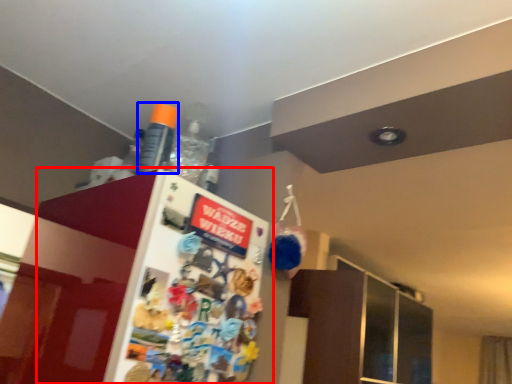
Question: Which point is further to the camera, fridge (highlighted by a red box) or bottle (highlighted by a blue box)?

Choices:
 (A) fridge
 (B) bottle

Answer: (B)